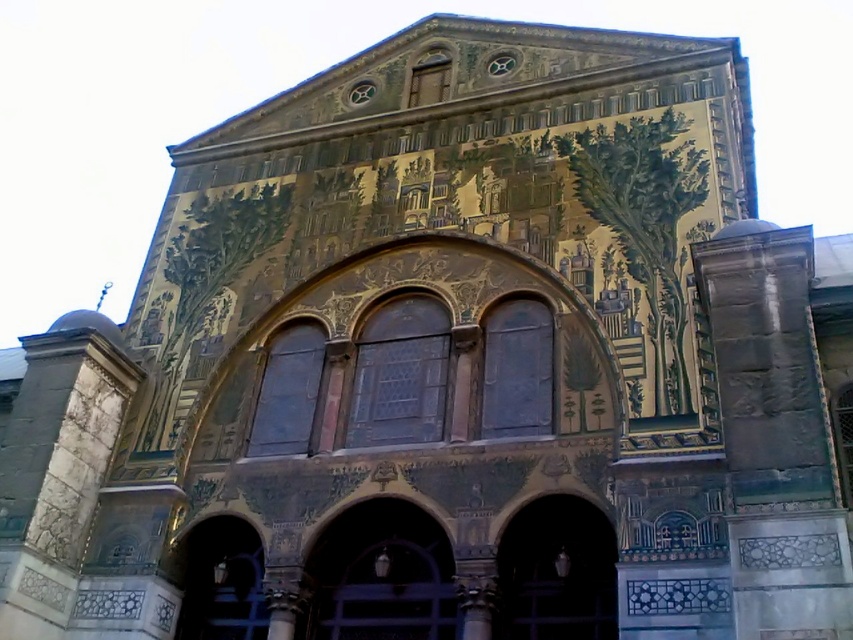
Identify the location of gray stone pillar at right. (775, 435).

Does point (762, 624) come behind point (409, 596)?

No, (762, 624) is closer to viewer.

What do you see at coordinates (775, 435) in the screenshot?
I see `gray stone pillar at right` at bounding box center [775, 435].

Where is `gray stone pillar at right`? This screenshot has height=640, width=853. gray stone pillar at right is located at coordinates (775, 435).

Consider the image. Between black glass door at center and dark wood door at lower left, which one appears on the left side from the viewer's perspective?

From the viewer's perspective, dark wood door at lower left appears more on the left side.

Can you confirm if black glass door at center is bigger than dark wood door at lower left?

Correct, black glass door at center is larger in size than dark wood door at lower left.

This screenshot has height=640, width=853. I want to click on black glass door at center, so click(556, 572).

Which of these two, dark wood door at center or dark wood door at lower left, stands shorter?

dark wood door at lower left is shorter.

Is point (392, 520) closer to camera compared to point (206, 564)?

Yes.

Image resolution: width=853 pixels, height=640 pixels. In order to click on dark wood door at center in this screenshot , I will do `click(381, 577)`.